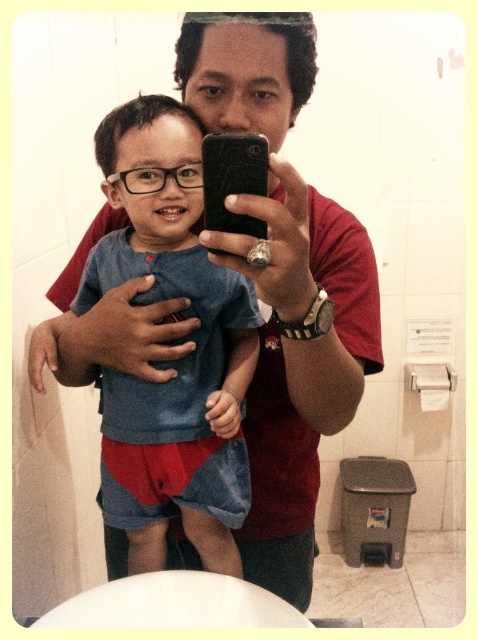
Who is higher up, blue denim shorts at center or black matte smartphone at center?

Positioned higher is black matte smartphone at center.

Which is behind, point (108, 276) or point (234, 136)?

The point (108, 276) is behind.

Find the location of a particular element. This screenshot has height=640, width=478. blue denim shorts at center is located at coordinates (180, 358).